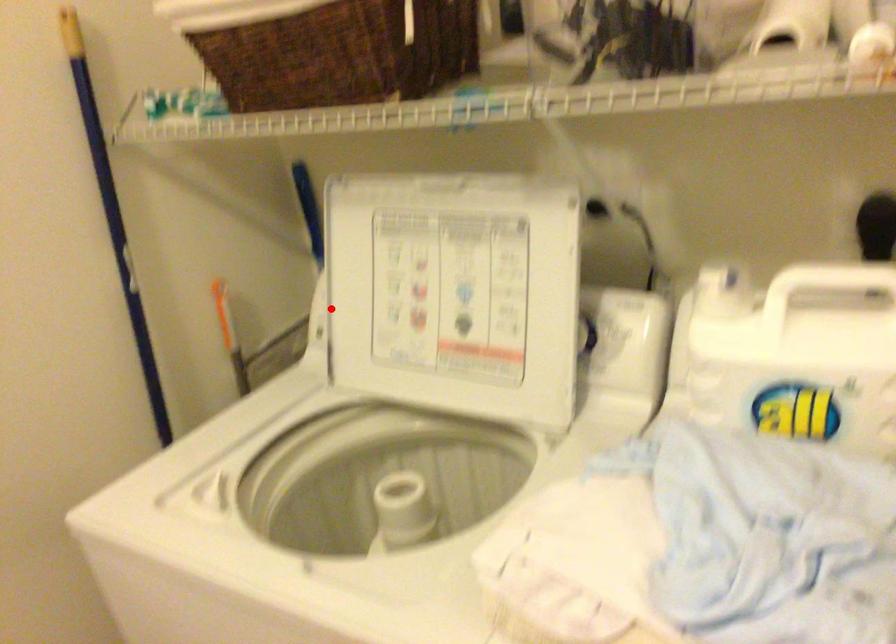
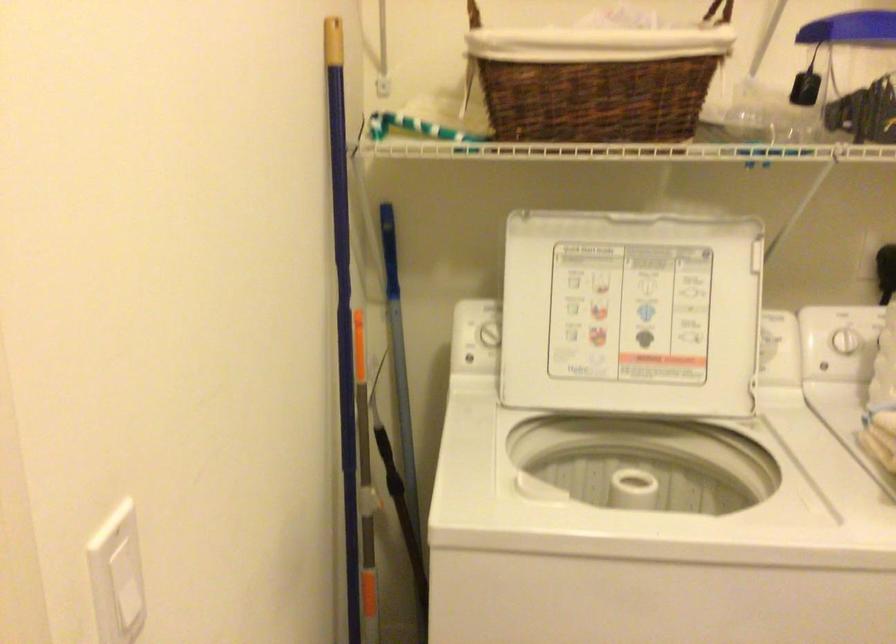
Find the pixel in the second image that matches the highlighted location in the first image.

(488, 334)